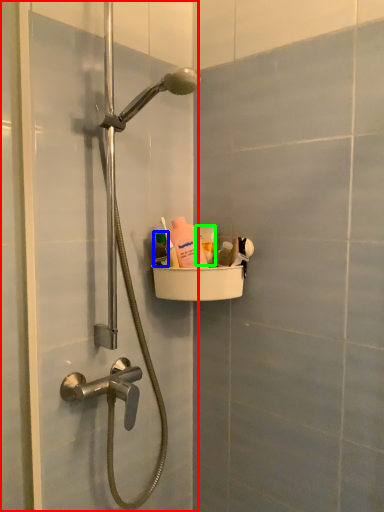
Question: Which object is the farthest from screen door (highlighted by a red box)? Choose among these: mouthwash (highlighted by a blue box) or mouthwash (highlighted by a green box).

Choices:
 (A) mouthwash
 (B) mouthwash

Answer: (B)